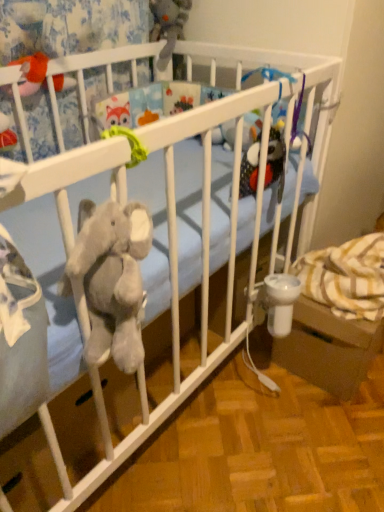
Question: From their relative heights in the image, would you say white plastic baby carriage at lower right is taller or shorter than fuzzy orange toy at upper left, which is the second toy from top to bottom?

Choices:
 (A) short
 (B) tall

Answer: (B)

Question: From a real-world perspective, is white plastic baby carriage at lower right physically located above or below fuzzy orange toy at upper left, the first toy when ordered from left to right?

Choices:
 (A) above
 (B) below

Answer: (B)

Question: Which object is positioned closest to the fuzzy orange toy at upper left, which ranks as the 1th toy in front-to-back order?

Choices:
 (A) white plastic baby carriage at lower right
 (B) gray plush toy at upper center, the first toy when ordered from back to front

Answer: (B)

Question: Which of these objects is positioned closest to the white plastic baby carriage at lower right?

Choices:
 (A) gray plush toy at upper center, which is the second toy from left to right
 (B) fuzzy orange toy at upper left, which appears as the 1th toy when ordered from the bottom

Answer: (B)